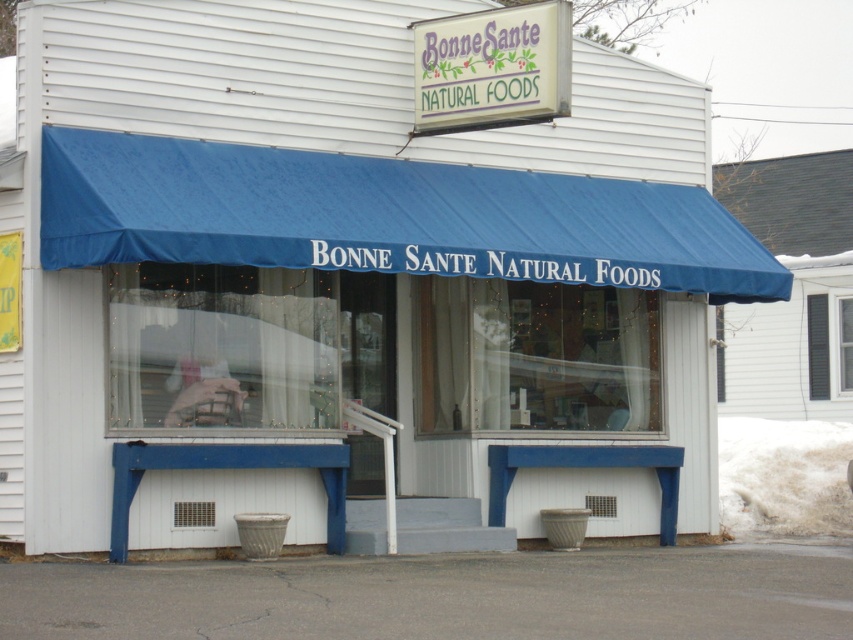
You are a delivery person trying to see the store name on the blue fabric canopy at center and the transparent plastic window at center. Which one can you read more easily from the street?

The transparent plastic window at center can be read more easily because it is taller than the blue fabric canopy at center, allowing more space for text visibility.

You are a delivery person with a box that is 2 meters long. You need to deliver it through the entrance of Bonne Sante Natural Foods. Can you fit the box horizontally through the space between the blue fabric canopy at center and the transparent plastic window at center?

The distance between the blue fabric canopy at center and transparent plastic window at center is 2.37 meters. Since the box is 2 meters long, it can fit horizontally through the space between them.